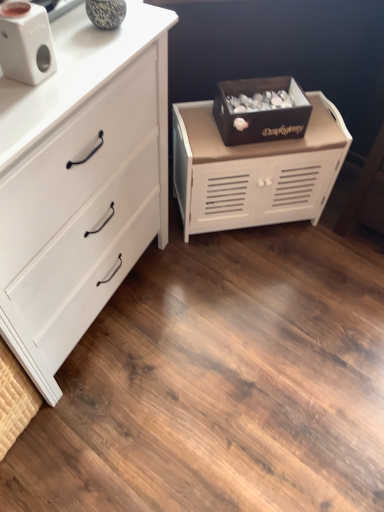
You are a GUI agent. You are given a task and a screenshot of the screen. Output one action in this format:
    pyautogui.click(x=<x>, y=<y>)
    Task: Click on the vacant area to the right of white matte chest of drawers at left, the first chest of drawers from the left
    The image size is (384, 512).
    Given the screenshot: What is the action you would take?
    pyautogui.click(x=211, y=322)